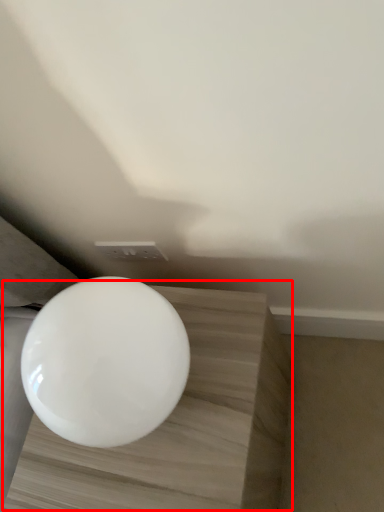
Question: Where is table (annotated by the red box) located in relation to toilet in the image?

Choices:
 (A) left
 (B) right

Answer: (B)